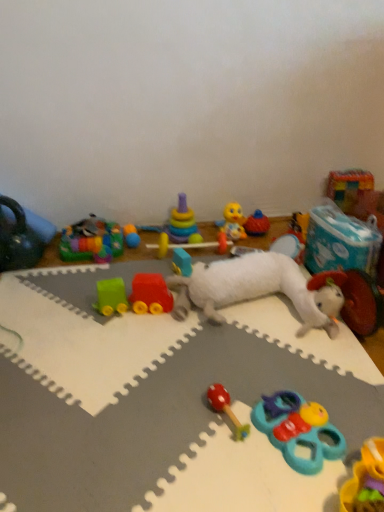
Question: Should I look upward or downward to see rubber block at center, which is the fifth toy in left-to-right order?

Choices:
 (A) up
 (B) down

Answer: (B)

Question: Does white plush lamb at center, arranged as the 3th toy when viewed from the right, have a greater height compared to plastic colorful blocks at upper right, the 15th toy when ordered from left to right?

Choices:
 (A) no
 (B) yes

Answer: (A)

Question: Is white plush lamb at center, the 13th toy viewed from the left, wider than plastic colorful blocks at upper right, the 15th toy when ordered from left to right?

Choices:
 (A) yes
 (B) no

Answer: (A)

Question: Is white plush lamb at center, arranged as the 3th toy when viewed from the right, facing towards plastic colorful blocks at upper right, which is the first toy in right-to-left order?

Choices:
 (A) yes
 (B) no

Answer: (B)

Question: Is plastic colorful blocks at upper right, the 15th toy when ordered from left to right, at the back of white plush lamb at center, the 13th toy viewed from the left?

Choices:
 (A) yes
 (B) no

Answer: (B)

Question: Considering the relative positions of white plush lamb at center, the 13th toy viewed from the left, and plastic colorful blocks at upper right, the 15th toy when ordered from left to right, in the image provided, is white plush lamb at center, the 13th toy viewed from the left, to the left of plastic colorful blocks at upper right, the 15th toy when ordered from left to right, from the viewer's perspective?

Choices:
 (A) no
 (B) yes

Answer: (B)

Question: Is white plush lamb at center, the 13th toy viewed from the left, further to camera compared to plastic colorful blocks at upper right, the 15th toy when ordered from left to right?

Choices:
 (A) no
 (B) yes

Answer: (A)

Question: Is plastic colorful blocks at upper right, which is the first toy in right-to-left order, in front of stacked plastic rings at center, which is the 12th toy from right to left?

Choices:
 (A) yes
 (B) no

Answer: (B)

Question: Does plastic colorful blocks at upper right, which is the first toy in right-to-left order, have a greater width compared to stacked plastic rings at center, which is the 12th toy from right to left?

Choices:
 (A) yes
 (B) no

Answer: (B)

Question: Is stacked plastic rings at center, which is the 12th toy from right to left, a part of plastic colorful blocks at upper right, which is the first toy in right-to-left order?

Choices:
 (A) yes
 (B) no

Answer: (B)

Question: From a real-world perspective, is plastic colorful blocks at upper right, the 15th toy when ordered from left to right, on top of stacked plastic rings at center, which is the 12th toy from right to left?

Choices:
 (A) yes
 (B) no

Answer: (A)

Question: Is plastic colorful blocks at upper right, which is the first toy in right-to-left order, not inside stacked plastic rings at center, which is the 12th toy from right to left?

Choices:
 (A) no
 (B) yes

Answer: (B)

Question: Is plastic colorful blocks at upper right, which is the first toy in right-to-left order, facing away from stacked plastic rings at center, the 4th toy from the left?

Choices:
 (A) no
 (B) yes

Answer: (A)

Question: Can you confirm if matte black kettlebell at left, placed as the 15th toy when sorted from right to left, is wider than multicolored plastic rainbow at upper left, the 2th toy when ordered from left to right?

Choices:
 (A) no
 (B) yes

Answer: (A)